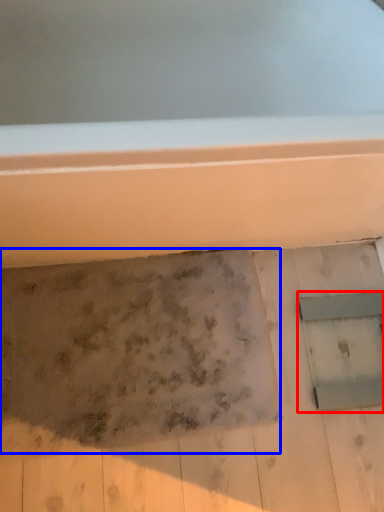
Question: Which point is further to the camera, window (highlighted by a red box) or footprint (highlighted by a blue box)?

Choices:
 (A) window
 (B) footprint

Answer: (A)